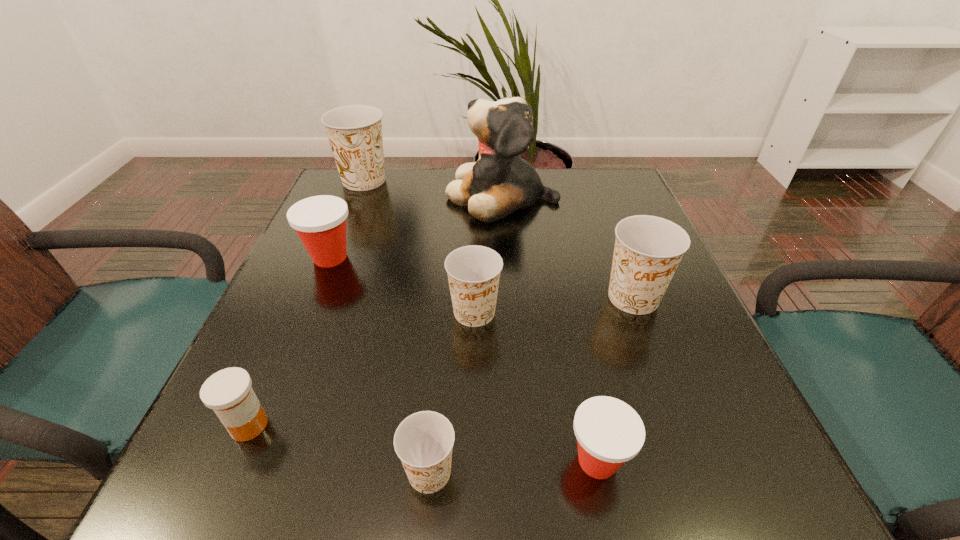
The height and width of the screenshot is (540, 960). I want to click on puppy, so click(500, 182).

The height and width of the screenshot is (540, 960). Identify the location of the farthest orange Dixie cup. (354, 132).

This screenshot has height=540, width=960. I want to click on the leftmost orange Dixie cup, so click(x=354, y=132).

Locate an element on the screen. The image size is (960, 540). the third tallest object is located at coordinates (648, 249).

This screenshot has width=960, height=540. What are the coordinates of `the rightmost Dixie cup` in the screenshot? It's located at (648, 249).

This screenshot has width=960, height=540. What are the coordinates of `the second farthest Dixie cup` in the screenshot? It's located at (320, 221).

This screenshot has height=540, width=960. Find the location of `the farther red-orange Dixie cup`. the farther red-orange Dixie cup is located at coordinates (320, 221).

Where is `the third biggest orange Dixie cup`? the third biggest orange Dixie cup is located at coordinates (473, 271).

Locate an element on the screen. This screenshot has height=540, width=960. orange medicine is located at coordinates (228, 392).

This screenshot has width=960, height=540. What are the coordinates of `the smaller red-orange Dixie cup` in the screenshot? It's located at (609, 432).